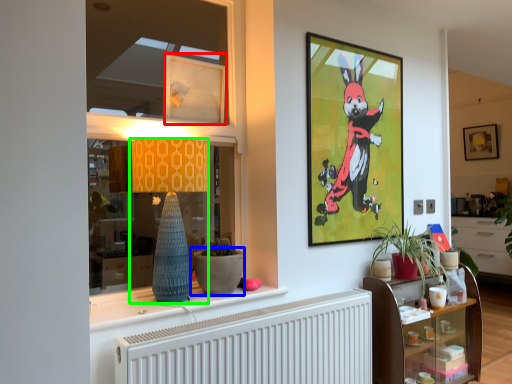
Question: Estimate the real-world distances between objects in this image. Which object is farther from picture frame (highlighted by a red box), flowerpot (highlighted by a blue box) or lamp (highlighted by a green box)?

Choices:
 (A) flowerpot
 (B) lamp

Answer: (A)